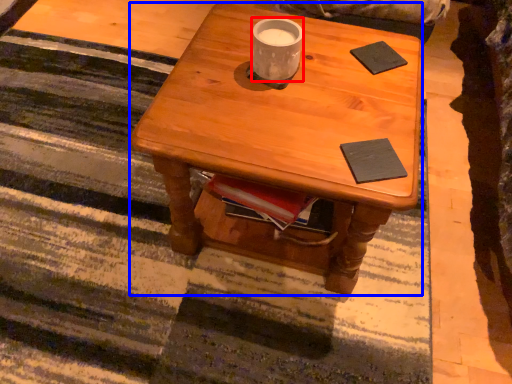
Question: Which object appears farthest to the camera in this image, coffee cup (highlighted by a red box) or desk (highlighted by a blue box)?

Choices:
 (A) coffee cup
 (B) desk

Answer: (A)